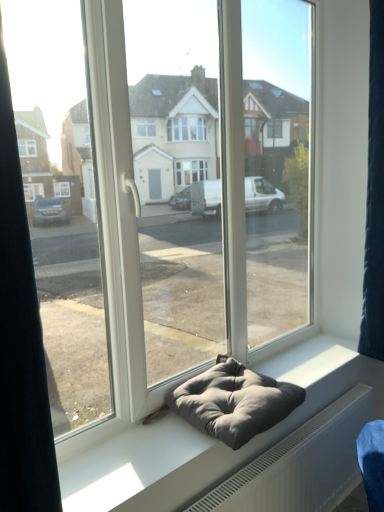
Question: In terms of width, does gray fabric cushion at center look wider or thinner when compared to gray fabric bean bag at center?

Choices:
 (A) wide
 (B) thin

Answer: (B)

Question: Considering the positions of gray fabric cushion at center and gray fabric bean bag at center in the image, is gray fabric cushion at center bigger or smaller than gray fabric bean bag at center?

Choices:
 (A) small
 (B) big

Answer: (A)

Question: Estimate the real-world distances between objects in this image. Which object is closer to the transparent glass door at center?

Choices:
 (A) gray fabric bean bag at center
 (B) gray fabric cushion at center
 (C) dark blue fabric at right

Answer: (A)

Question: Which object is the closest to the gray fabric bean bag at center?

Choices:
 (A) transparent glass door at center
 (B) dark blue fabric at right
 (C) gray fabric cushion at center

Answer: (C)